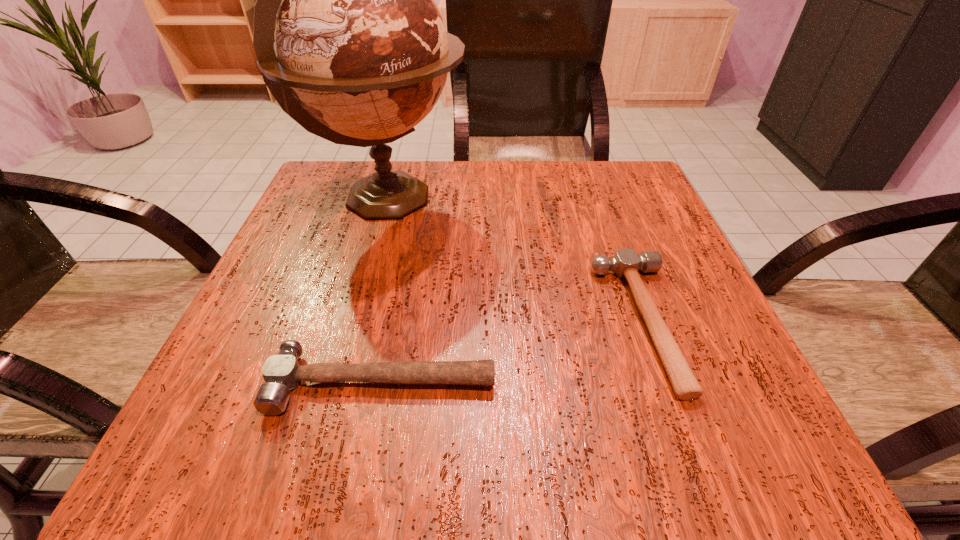
Image resolution: width=960 pixels, height=540 pixels. I want to click on the tallest object, so [x=363, y=54].

Locate an element on the screen. globe is located at coordinates (363, 54).

Locate an element on the screen. the left hammer is located at coordinates (282, 372).

You are a GUI agent. You are given a task and a screenshot of the screen. Output one action in this format:
    pyautogui.click(x=<x>, y=<y>)
    Task: Click on the rightmost object
    Image resolution: width=960 pixels, height=540 pixels.
    Given the screenshot: What is the action you would take?
    pyautogui.click(x=626, y=263)

Identify the location of vacant space located 0.160m on the front of the tallest object showing Asia. (540, 199).

Where is `vacant space located 0.380m on the back of the rightmost object`? vacant space located 0.380m on the back of the rightmost object is located at coordinates (585, 162).

Where is `object situated at the far edge`? The image size is (960, 540). object situated at the far edge is located at coordinates (363, 54).

The width and height of the screenshot is (960, 540). In order to click on object that is at the near edge in this screenshot , I will do `click(282, 372)`.

The width and height of the screenshot is (960, 540). In order to click on globe that is at the left edge in this screenshot , I will do `click(363, 54)`.

Find the location of `hammer that is at the left edge`. hammer that is at the left edge is located at coordinates (282, 372).